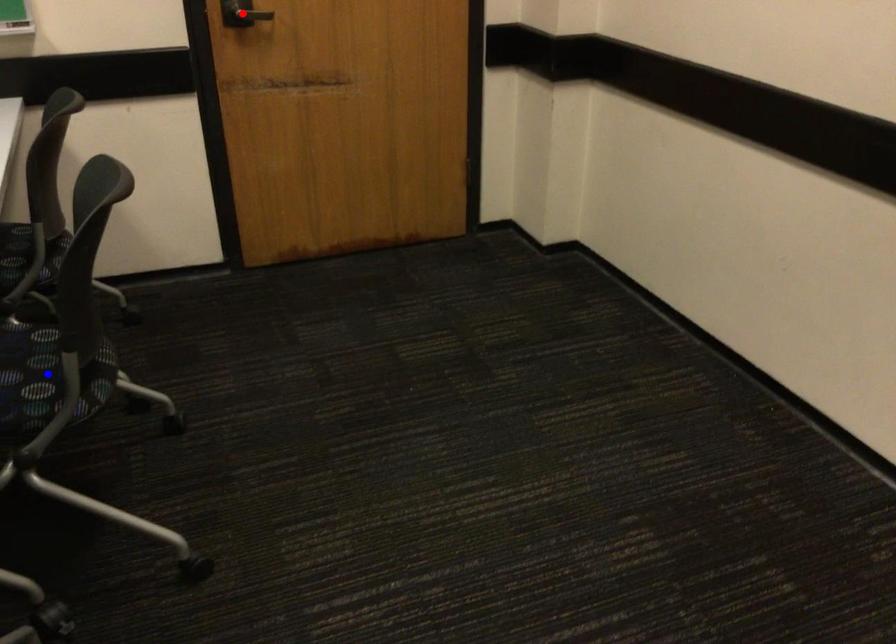
Question: Which of the two points in the image is closer to the camera?

Choices:
 (A) Blue point is closer.
 (B) Red point is closer.

Answer: (A)